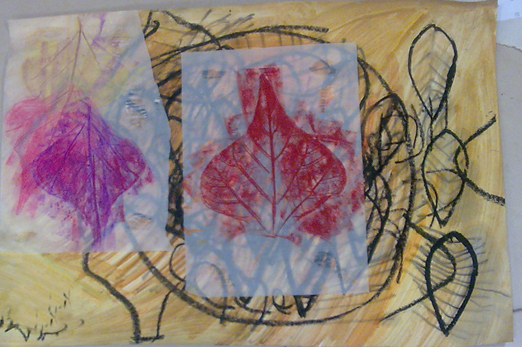
This screenshot has height=347, width=522. Identify the location of bottom of artwork. (252, 338).